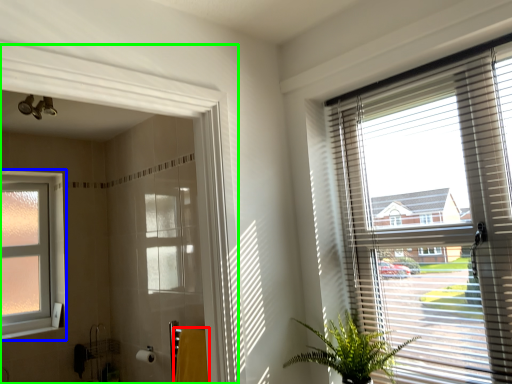
Question: Which is farther away from bath towel (highlighted by a red box)? window (highlighted by a blue box) or screen door (highlighted by a green box)?

Choices:
 (A) window
 (B) screen door

Answer: (A)